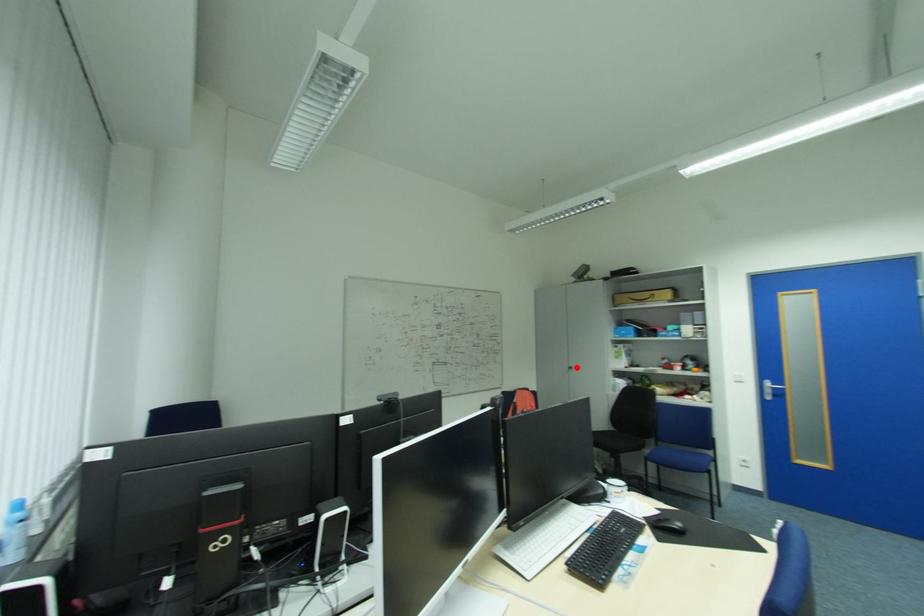
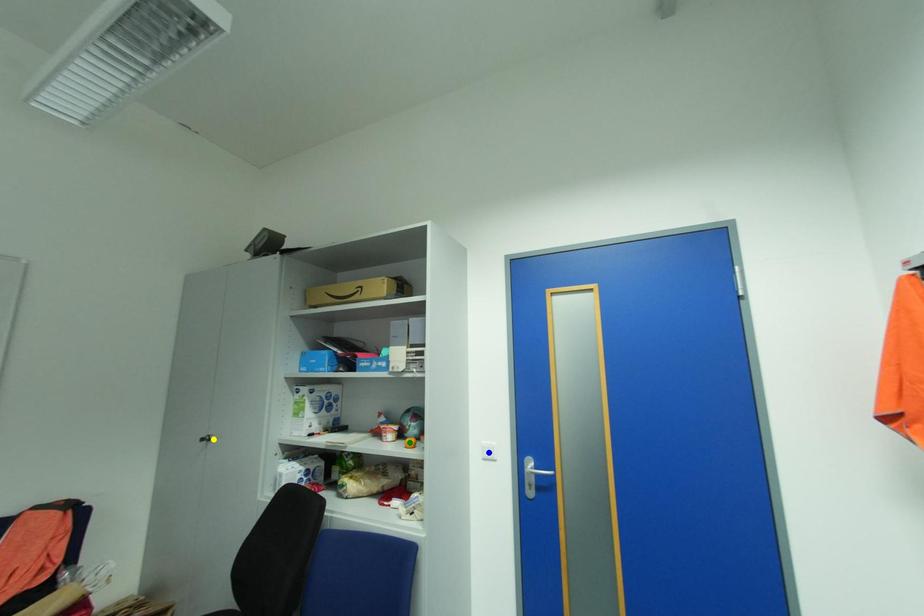
Question: I am providing you with two images of the same scene from different viewpoints. A red point is marked on the first image. You are given multiple points on the second image. Which spot in image 2 lines up with the point in image 1?

Choices:
 (A) yellow point
 (B) green point
 (C) blue point

Answer: (A)